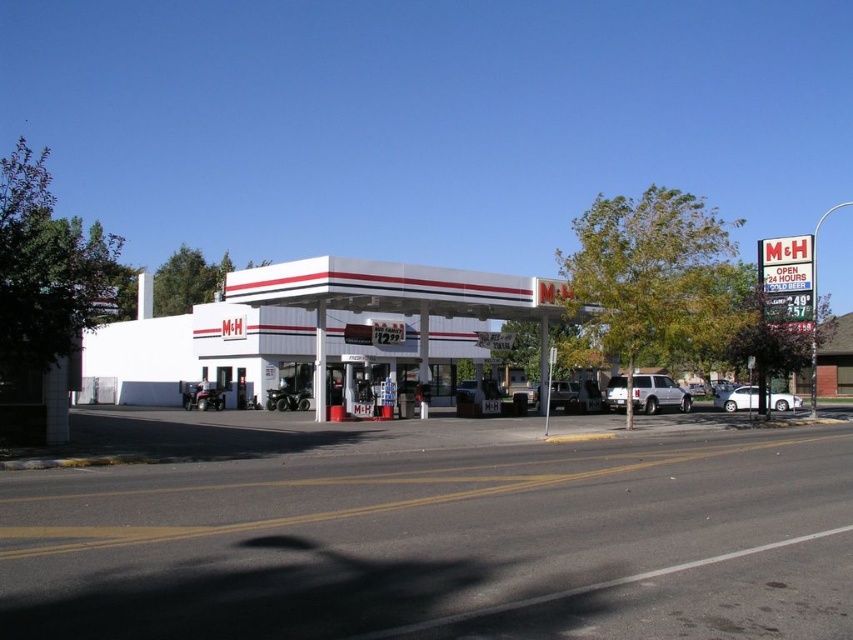
Question: Does white matte gas station at center have a greater width compared to white matte suv at center?

Choices:
 (A) no
 (B) yes

Answer: (B)

Question: Which point appears farthest from the camera in this image?

Choices:
 (A) (643, 392)
 (B) (740, 403)

Answer: (B)

Question: Does white matte suv at center appear under white matte sedan at lower right?

Choices:
 (A) no
 (B) yes

Answer: (A)

Question: From the image, what is the correct spatial relationship of white matte gas station at center in relation to white matte sedan at lower right?

Choices:
 (A) below
 (B) above

Answer: (B)

Question: Which object is the closest to the white matte sedan at lower right?

Choices:
 (A) white matte suv at center
 (B) white matte gas station at center

Answer: (A)

Question: Which of the following is the closest to the observer?

Choices:
 (A) white matte gas station at center
 (B) white matte suv at center
 (C) white matte sedan at lower right

Answer: (A)